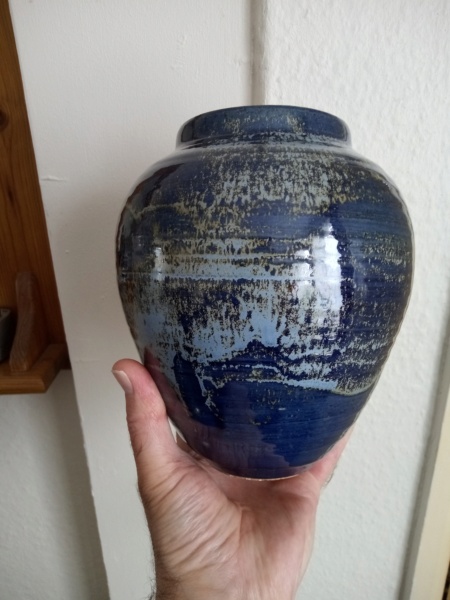
I want to click on blue on vase, so click(212, 420).